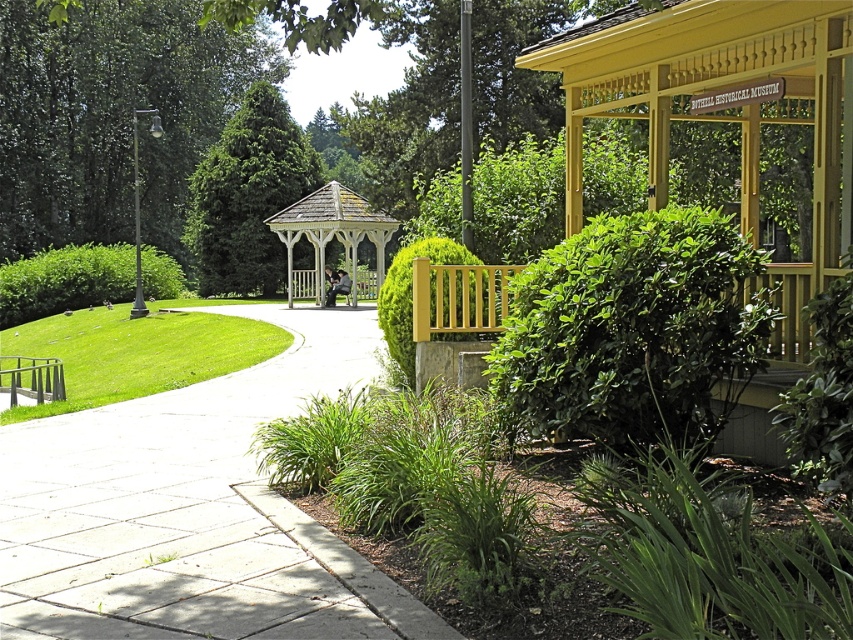
Is green textured tree at center taller than green leafy bush at left?

Correct, green textured tree at center is much taller as green leafy bush at left.

Consider the image. Which is more to the left, green textured tree at center or green leafy bush at left?

green leafy bush at left is more to the left.

Which is behind, point (212, 284) or point (0, 308)?

The point (212, 284) is behind.

Where is `green textured tree at center`? Image resolution: width=853 pixels, height=640 pixels. green textured tree at center is located at coordinates (247, 195).

Can you confirm if green leafy tree at upper left is positioned below green leafy bush at left?

Actually, green leafy tree at upper left is above green leafy bush at left.

Describe the element at coordinates (112, 116) in the screenshot. This screenshot has height=640, width=853. I see `green leafy tree at upper left` at that location.

Locate an element on the screen. The height and width of the screenshot is (640, 853). green leafy tree at upper left is located at coordinates (112, 116).

Who is higher up, white wooden gazebo at center or wooden park bench at center?

white wooden gazebo at center is above.

Between point (383, 218) and point (328, 292), which one is positioned in front?

Point (383, 218)

In order to click on white wooden gazebo at center in this screenshot , I will do `click(331, 237)`.

At what (x,y) coordinates should I click in order to perform the action: click on white wooden gazebo at center. Please return your answer as a coordinate pair (x, y). Looking at the image, I should click on (331, 237).